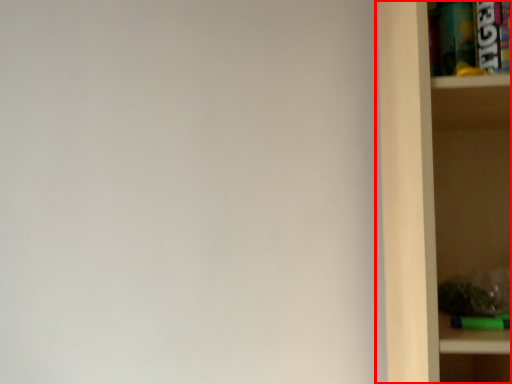
Question: From the image's perspective, what is the correct spatial relationship of shelf (annotated by the red box) in relation to cabinet?

Choices:
 (A) below
 (B) above

Answer: (A)